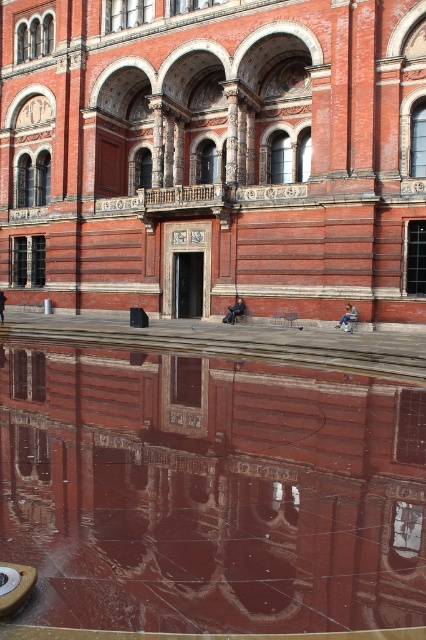
You are standing in front of the grand red brick building and want to walk towards the smooth reflective water at center. Which direction should you move to reach it from the smooth stone plaza at center?

You should move to the right from the smooth stone plaza at center to reach the smooth reflective water at center since the plaza is located to the left of the water.

You are standing at the entrance of the grand red brick building and want to walk to the smooth stone plaza at center. Which direction should you go?

The smooth stone plaza at center is located directly in front of the building, so you should walk forward towards it.

You are standing in front of the grand red brick building and want to walk to the smooth reflective water at center. Which path would you take, the smooth stone plaza at center or another path? Explain why based on their sizes.

You should take the smooth stone plaza at center because it is bigger than the smooth reflective water at center, making it a safer and more accessible path to reach the water.